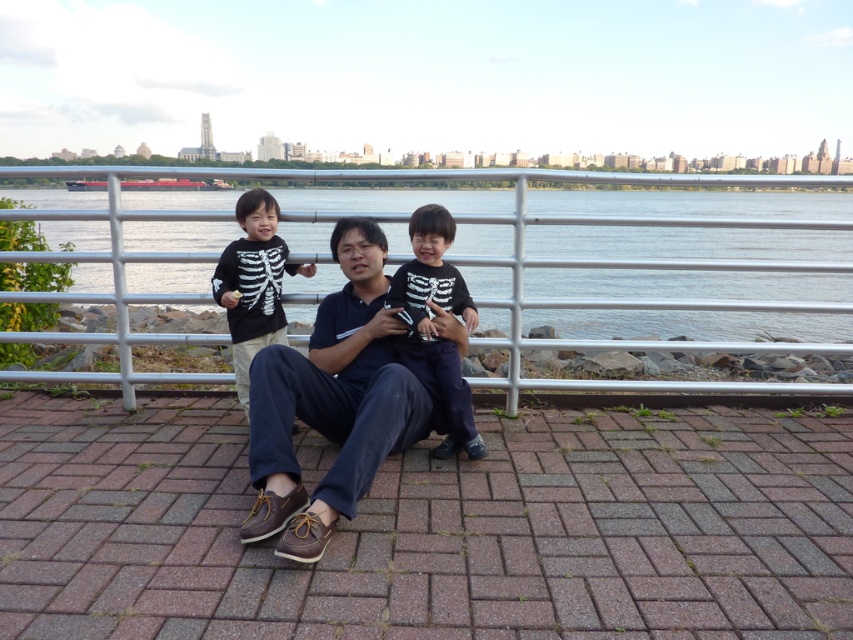
Question: Is brown leather shoes at center positioned at the back of black matte skeleton shirt at left?

Choices:
 (A) yes
 (B) no

Answer: (B)

Question: Which point is closer to the camera?

Choices:
 (A) (451, 435)
 (B) (688, 330)
 (C) (250, 227)

Answer: (A)

Question: Is blue water at center to the right of black matte skeleton shirt at center from the viewer's perspective?

Choices:
 (A) yes
 (B) no

Answer: (B)

Question: Is brown leather shoes at center further to the viewer compared to black matte skeleton shirt at center?

Choices:
 (A) no
 (B) yes

Answer: (A)

Question: Among these points, which one is nearest to the camera?

Choices:
 (A) (451, 268)
 (B) (265, 412)
 (C) (636, 196)
 (D) (248, 218)

Answer: (B)

Question: Among these points, which one is farthest from the camera?

Choices:
 (A) (235, 262)
 (B) (500, 292)
 (C) (321, 305)
 (D) (456, 353)

Answer: (B)